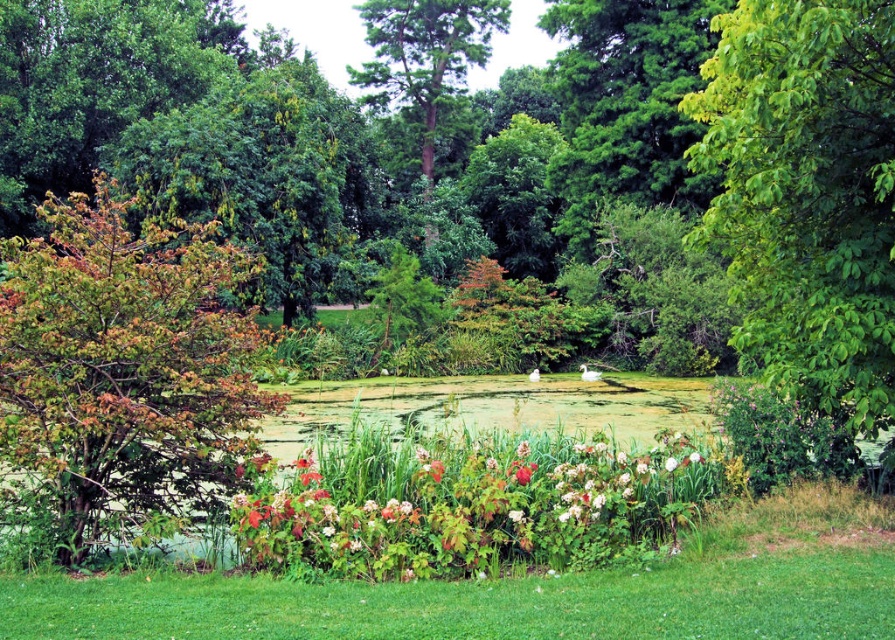
Question: Can you confirm if multicolored foliage bush at left is positioned above green textured tree at center?

Choices:
 (A) yes
 (B) no

Answer: (B)

Question: Does green leafy tree at right appear under green textured tree at center?

Choices:
 (A) no
 (B) yes

Answer: (B)

Question: Which point is closer to the camera taking this photo?

Choices:
 (A) (407, 477)
 (B) (817, 198)

Answer: (B)

Question: Does green leafy bush at center have a lesser width compared to green textured tree at center?

Choices:
 (A) no
 (B) yes

Answer: (B)

Question: Which point is farther to the camera?

Choices:
 (A) green leafy tree at right
 (B) multicolored foliage bush at left
 (C) green textured tree at center
 (D) green leafy bush at center

Answer: (C)

Question: Which point appears farthest from the camera in this image?

Choices:
 (A) (799, 77)
 (B) (228, 330)
 (C) (359, 515)
 (D) (418, 16)

Answer: (D)